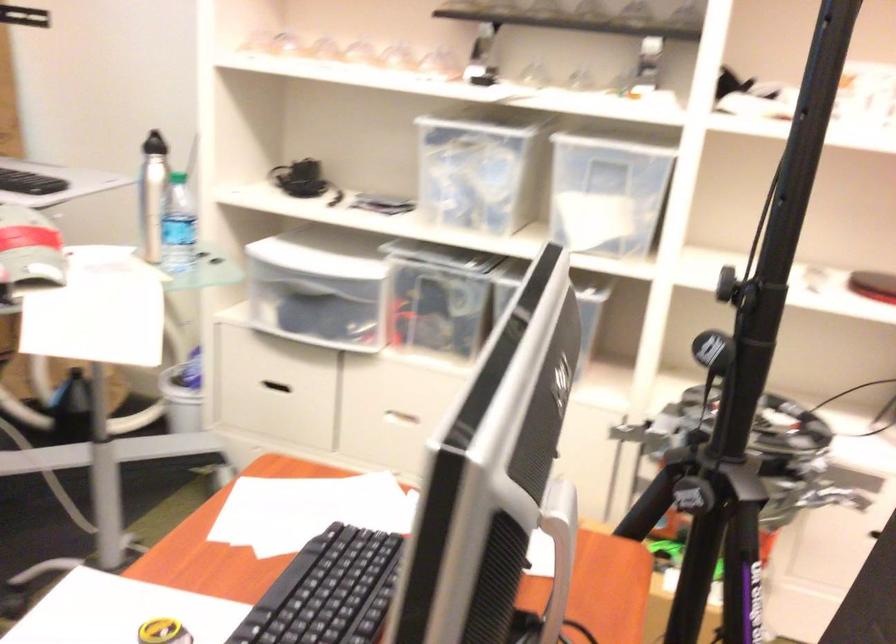
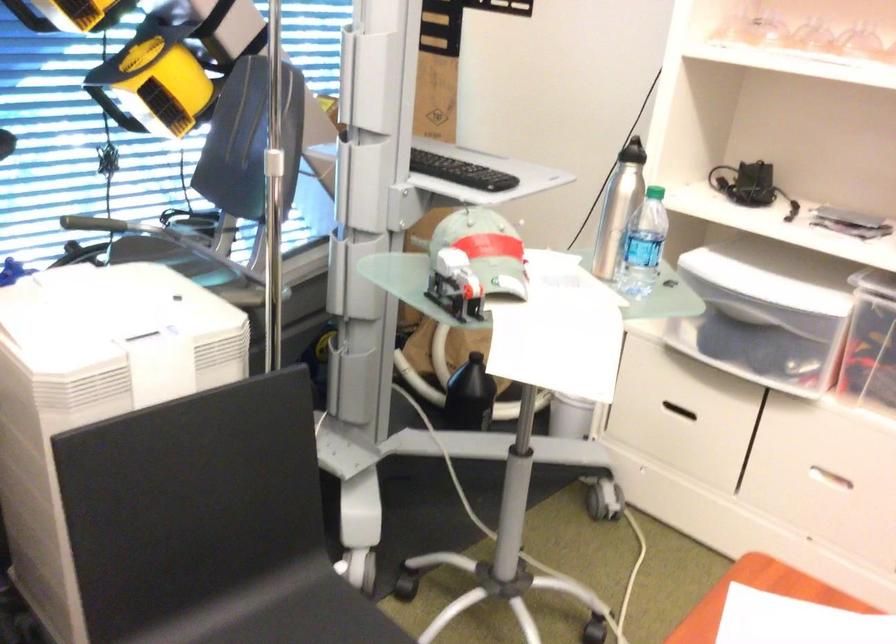
In the second image, find the point that corresponds to (179,228) in the first image.

(643, 245)